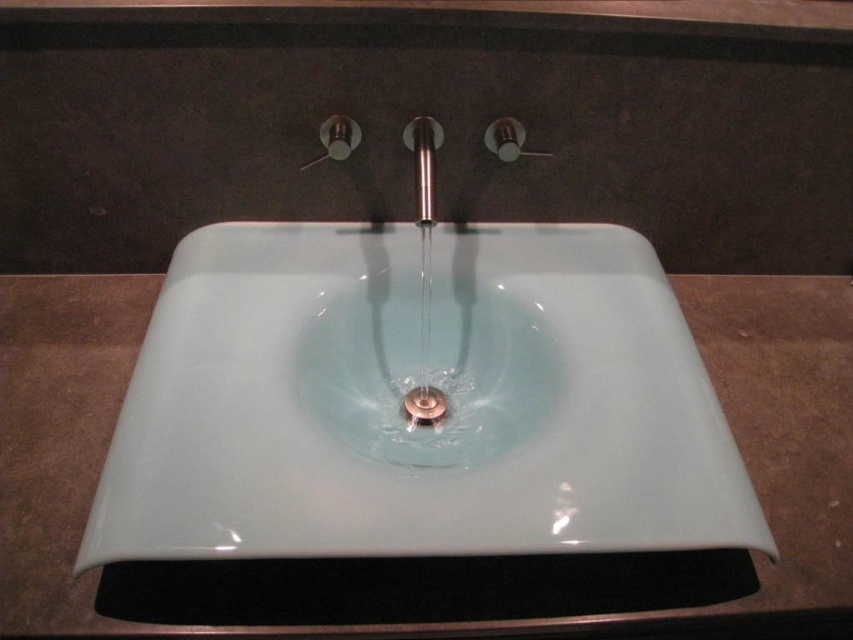
Is polished stainless steel faucet at center above satin nickel drain at center?

Correct, polished stainless steel faucet at center is located above satin nickel drain at center.

Describe the element at coordinates (422, 163) in the screenshot. I see `polished stainless steel faucet at center` at that location.

Between point (434, 177) and point (415, 419), which one is positioned in front?

Point (434, 177) is more forward.

At what (x,y) coordinates should I click in order to perform the action: click on polished stainless steel faucet at center. Please return your answer as a coordinate pair (x, y). This screenshot has width=853, height=640. Looking at the image, I should click on (422, 163).

Between white glossy sink at center and polished stainless steel faucet at center, which one is positioned lower?

Positioned lower is white glossy sink at center.

Looking at this image, does white glossy sink at center have a lesser height compared to polished stainless steel faucet at center?

No, white glossy sink at center is not shorter than polished stainless steel faucet at center.

The image size is (853, 640). I want to click on white glossy sink at center, so click(x=410, y=387).

Does white glossy sink at center appear on the right side of satin nickel drain at center?

No, white glossy sink at center is not to the right of satin nickel drain at center.

Does white glossy sink at center appear under satin nickel drain at center?

Incorrect, white glossy sink at center is not positioned below satin nickel drain at center.

Is point (697, 467) in front of point (433, 397)?

Yes, point (697, 467) is closer to viewer.

In order to click on white glossy sink at center in this screenshot , I will do `click(410, 387)`.